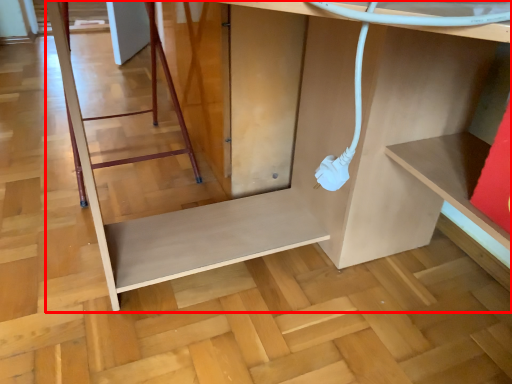
Question: From the image's perspective, where is furniture (annotated by the red box) located relative to ladder?

Choices:
 (A) below
 (B) above

Answer: (A)